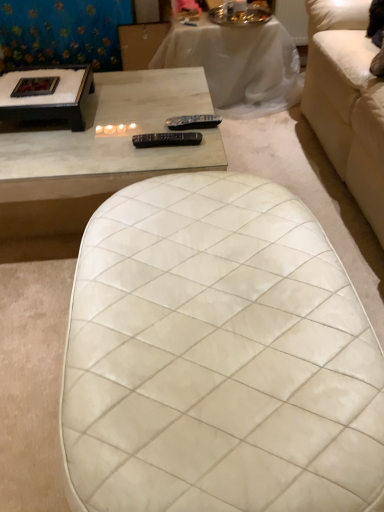
At what (x,y) coordinates should I click in order to perform the action: click on vacant space situated above white quilted ottoman at center, the first table ordered from the bottom (from a real-world perspective). Please return your answer as a coordinate pair (x, y). This screenshot has width=384, height=512. Looking at the image, I should click on (200, 289).